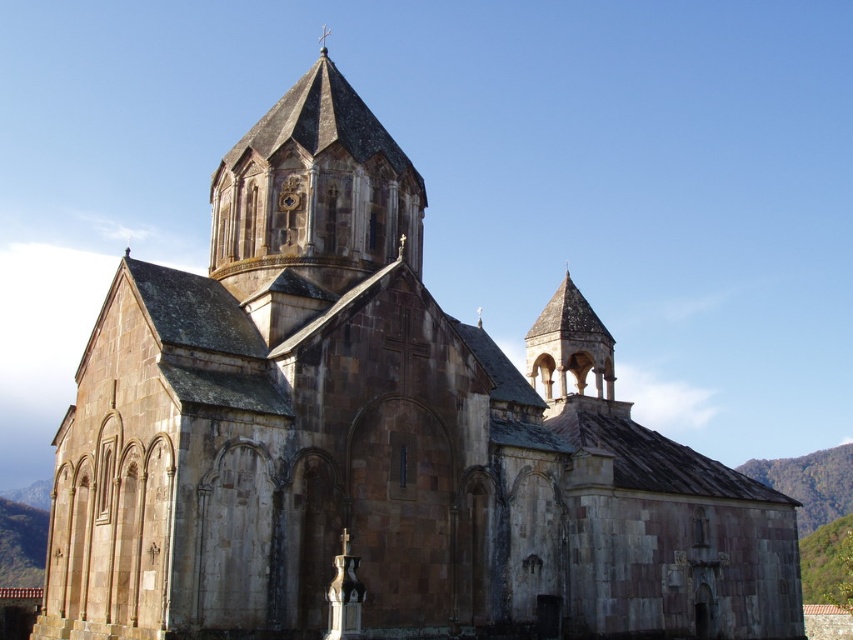
You are standing in front of the church and notice two points marked on the building. The first point is at coordinate point (x=340, y=120) and the second at point (x=321, y=42). Which point is closer to you?

Point (x=340, y=120) is closer to the viewer than point (x=321, y=42).

You are standing in front of the church and want to take a photo of both the brown stone tower at center and the smooth stone spire at upper center. Which one will appear larger in the photo?

The brown stone tower at center will appear larger in the photo because it is closer to the viewer than the smooth stone spire at upper center.

You are an architect examining the church. You need to determine which of the two structures, the brown stone tower at center or the smooth stone spire at upper center, has a larger diameter. Based on the description provided, which one is wider?

The smooth stone spire at upper center has a larger diameter than the brown stone tower at center, as the description states that the brown stone tower at center is thinner than the smooth stone spire at upper center.